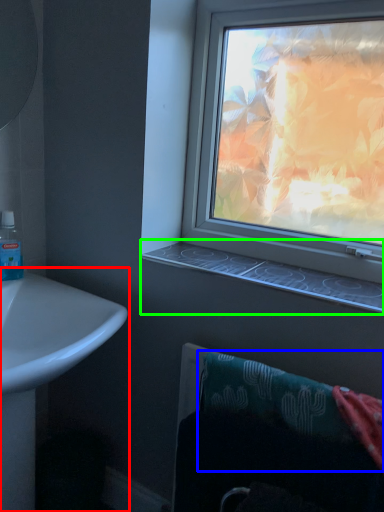
Question: Based on their relative distances, which object is farther from sink (highlighted by a red box)? Choose from bath towel (highlighted by a blue box) and window sill (highlighted by a green box).

Choices:
 (A) bath towel
 (B) window sill

Answer: (A)